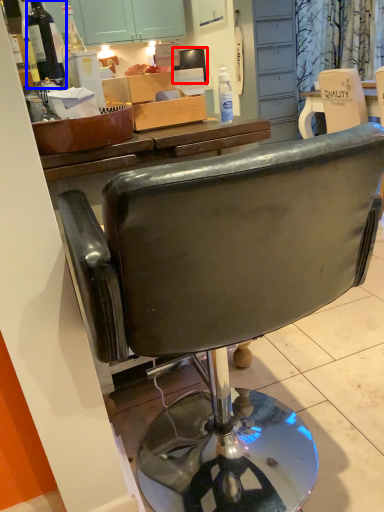
Question: Which object is further to the camera taking this photo, television (highlighted by a red box) or bottle (highlighted by a blue box)?

Choices:
 (A) television
 (B) bottle

Answer: (A)